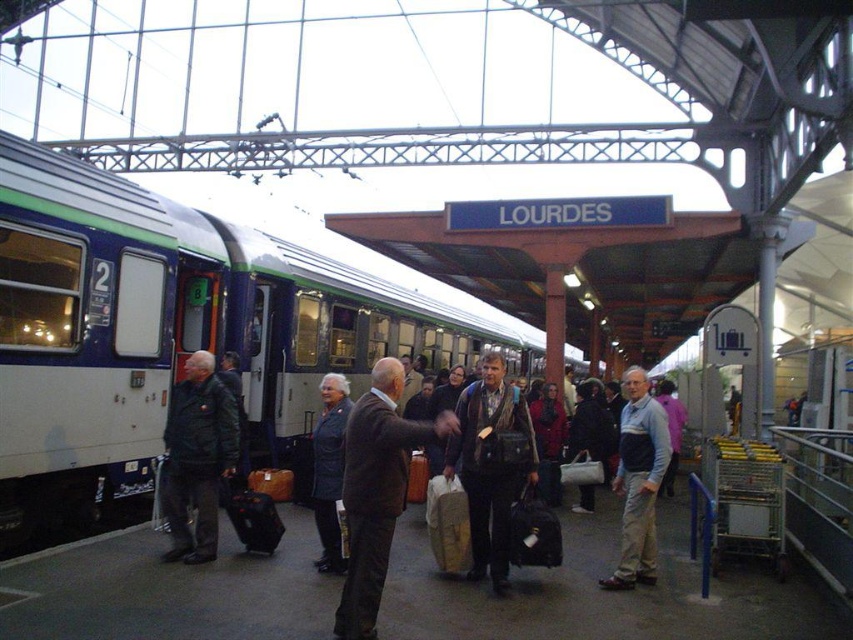
Question: Which point appears farthest from the camera in this image?

Choices:
 (A) (512, 420)
 (B) (624, 413)

Answer: (B)

Question: Considering the real-world distances, which object is closest to the brown leather jacket at center?

Choices:
 (A) light brown leather jacket at center
 (B) dark gray fabric suitcase at center
 (C) dark blue leather jacket at left

Answer: (B)

Question: Does brown leather jacket at center have a smaller size compared to leather backpack at center?

Choices:
 (A) no
 (B) yes

Answer: (A)

Question: Among these points, which one is farthest from the camera?

Choices:
 (A) (387, 541)
 (B) (508, 484)

Answer: (B)

Question: Is leather backpack at center to the right of dark blue leather jacket at left from the viewer's perspective?

Choices:
 (A) no
 (B) yes

Answer: (B)

Question: Can you confirm if light brown leather jacket at center is thinner than dark gray fabric suitcase at center?

Choices:
 (A) yes
 (B) no

Answer: (B)